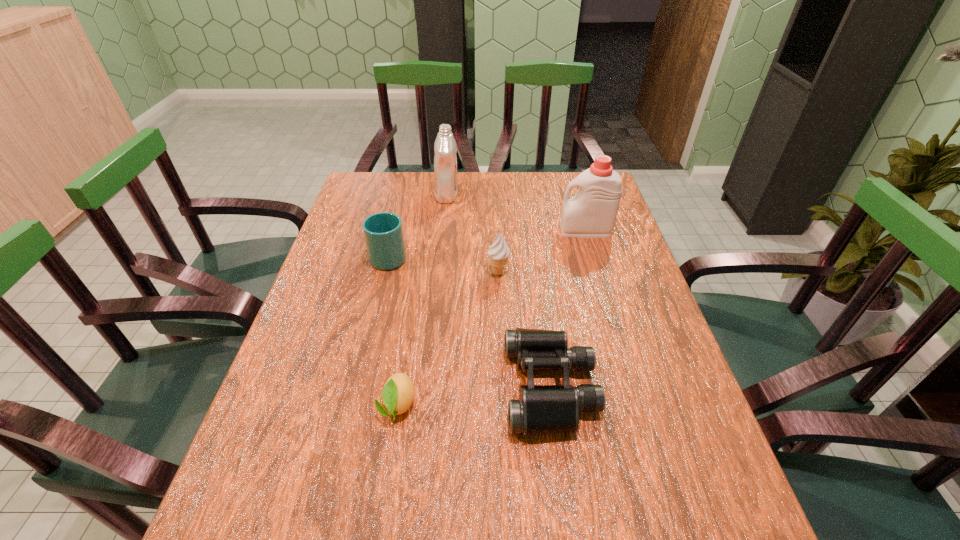
Where is `the left detergent`? the left detergent is located at coordinates (445, 160).

Locate an element on the screen. the farther detergent is located at coordinates (445, 160).

Where is `the second farthest object`? The image size is (960, 540). the second farthest object is located at coordinates (591, 213).

Identify the location of the right detergent. The height and width of the screenshot is (540, 960). (591, 213).

Where is `icecream`? icecream is located at coordinates (498, 253).

Where is `the leftmost object`? the leftmost object is located at coordinates (383, 232).

The height and width of the screenshot is (540, 960). Identify the location of the fifth tallest object. (541, 409).

Find the location of a particular element. Image resolution: width=960 pixels, height=540 pixels. the shortest object is located at coordinates (397, 396).

Where is `free space located on the right of the farther detergent`? free space located on the right of the farther detergent is located at coordinates (573, 195).

At what (x,y) coordinates should I click in order to perform the action: click on free space located 0.130m on the handle side of the right detergent. Please return your answer as a coordinate pair (x, y). This screenshot has width=960, height=540. Looking at the image, I should click on pos(516,231).